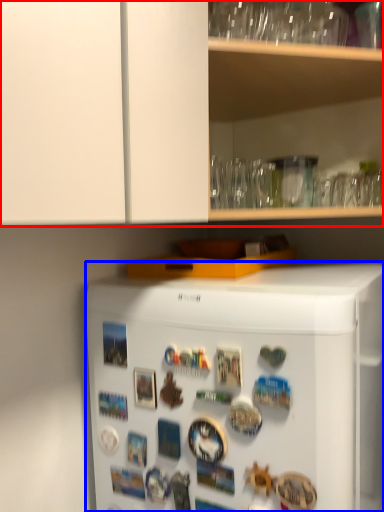
Question: Which of the following is the farthest to the observer, cabinetry (highlighted by a red box) or refrigerator (highlighted by a blue box)?

Choices:
 (A) cabinetry
 (B) refrigerator

Answer: (A)